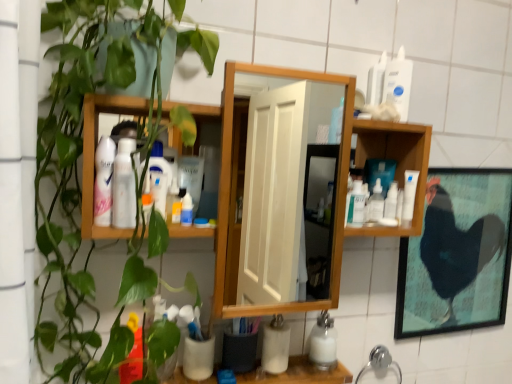
Locate an element on the screen. This screenshot has height=384, width=512. free space above white matte cup at lower center (from a real-world perspective) is located at coordinates (241, 367).